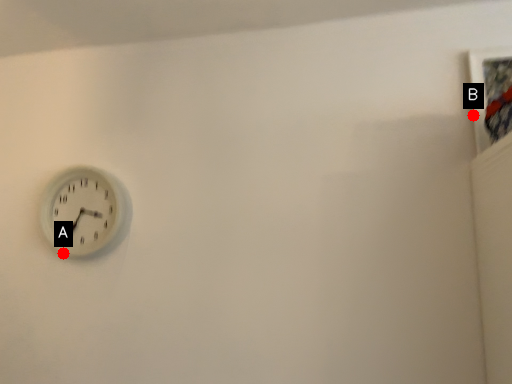
Question: Two points are circled on the image, labeled by A and B beside each circle. Which point is farther to the camera?

Choices:
 (A) A is further
 (B) B is further

Answer: (A)